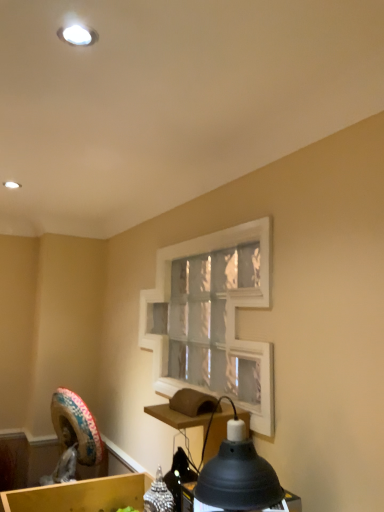
Question: From a real-world perspective, is white matte window frame at center below wooden cardboard box at lower left?

Choices:
 (A) no
 (B) yes

Answer: (A)

Question: Is white matte window frame at center behind wooden cardboard box at lower left?

Choices:
 (A) no
 (B) yes

Answer: (A)

Question: Does white matte window frame at center have a lesser height compared to wooden cardboard box at lower left?

Choices:
 (A) no
 (B) yes

Answer: (A)

Question: Is white matte window frame at center outside of wooden cardboard box at lower left?

Choices:
 (A) yes
 (B) no

Answer: (A)

Question: Does white matte window frame at center contain wooden cardboard box at lower left?

Choices:
 (A) yes
 (B) no

Answer: (B)

Question: Considering the positions of point (147, 300) and point (271, 501), is point (147, 300) closer or farther from the camera than point (271, 501)?

Choices:
 (A) closer
 (B) farther

Answer: (B)

Question: From their relative heights in the image, would you say white matte window frame at center is taller or shorter than matte black lampshade at lower center?

Choices:
 (A) tall
 (B) short

Answer: (A)

Question: Looking at their shapes, would you say white matte window frame at center is wider or thinner than matte black lampshade at lower center?

Choices:
 (A) thin
 (B) wide

Answer: (A)

Question: From a real-world perspective, relative to matte black lampshade at lower center, is white matte window frame at center vertically above or below?

Choices:
 (A) below
 (B) above

Answer: (B)

Question: Is wooden cardboard box at lower left taller or shorter than white matte window frame at center?

Choices:
 (A) tall
 (B) short

Answer: (B)

Question: Based on their sizes in the image, would you say wooden cardboard box at lower left is bigger or smaller than white matte window frame at center?

Choices:
 (A) small
 (B) big

Answer: (A)

Question: Do you think wooden cardboard box at lower left is within white matte window frame at center, or outside of it?

Choices:
 (A) outside
 (B) inside

Answer: (A)

Question: From a real-world perspective, relative to white matte window frame at center, is wooden cardboard box at lower left vertically above or below?

Choices:
 (A) above
 (B) below

Answer: (B)

Question: Would you say matte black lampshade at lower center is inside or outside white matte window frame at center?

Choices:
 (A) outside
 (B) inside

Answer: (A)

Question: From the image's perspective, is matte black lampshade at lower center positioned above or below white matte window frame at center?

Choices:
 (A) above
 (B) below

Answer: (B)